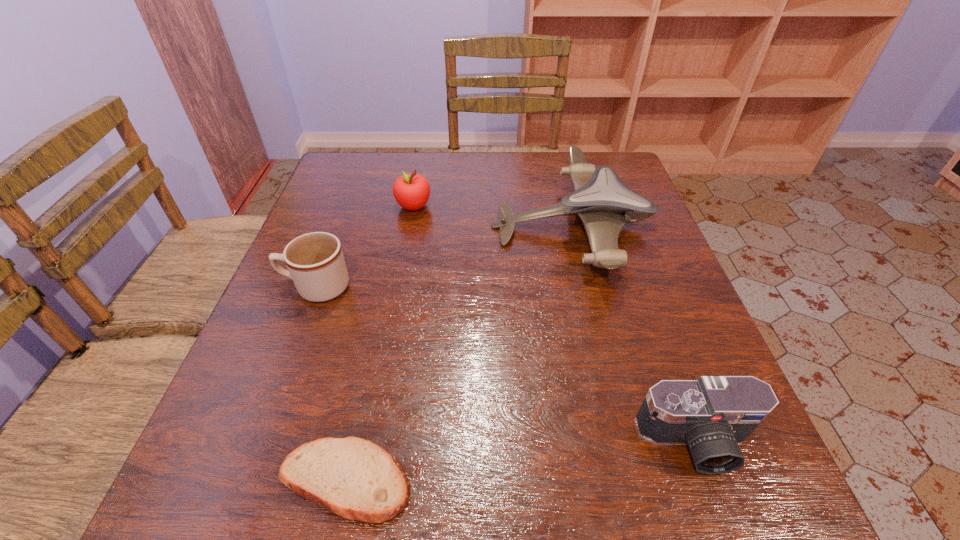
At what (x,y) coordinates should I click in order to perform the action: click on object present at the near right corner. Please return your answer as a coordinate pair (x, y). Looking at the image, I should click on (713, 414).

Locate an element on the screen. This screenshot has width=960, height=540. vacant region at the far edge of the desktop is located at coordinates (491, 186).

In the image, there is a desktop. At what (x,y) coordinates should I click in order to perform the action: click on free region at the left edge. Please return your answer as a coordinate pair (x, y). The image size is (960, 540). Looking at the image, I should click on (283, 289).

The image size is (960, 540). Find the location of `free location at the far left corner`. free location at the far left corner is located at coordinates (346, 157).

This screenshot has width=960, height=540. Find the location of `vacant space at the far right corner of the desktop`. vacant space at the far right corner of the desktop is located at coordinates (627, 186).

In order to click on blank space at the near right corner of the desktop in this screenshot , I will do `click(766, 483)`.

Where is `free space between the drone and the camera`? The image size is (960, 540). free space between the drone and the camera is located at coordinates (634, 334).

This screenshot has width=960, height=540. Identify the location of vacant space that is in between the drone and the apple. (492, 217).

The height and width of the screenshot is (540, 960). Find the location of `empty space that is in between the mug and the camera`. empty space that is in between the mug and the camera is located at coordinates (507, 364).

This screenshot has height=540, width=960. I want to click on empty space between the camera and the apple, so click(x=555, y=324).